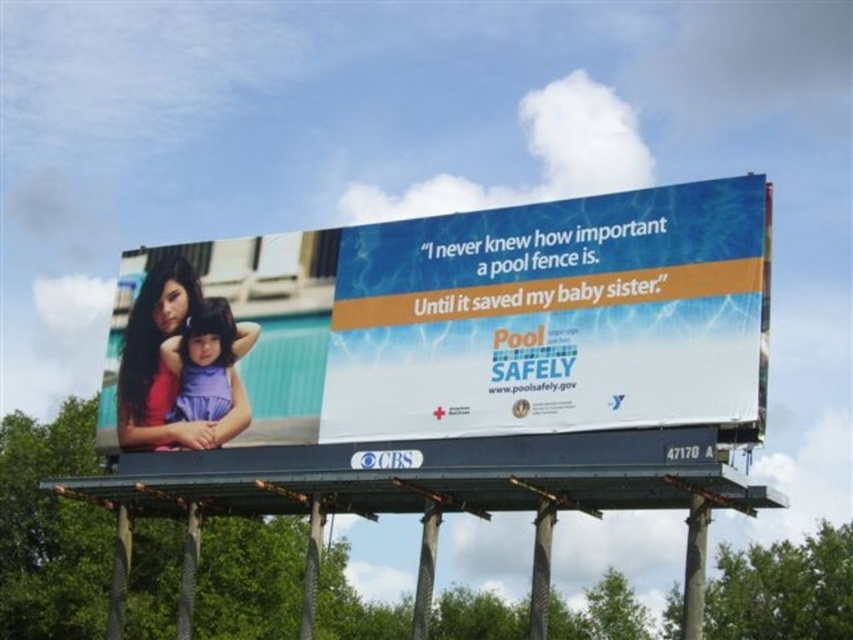
You are a city planner reviewing outdoor advertisements. You need to ensure that all billboards comply with the city ordinance requiring them to be placed at least 2 meters away from any public walkway. Given that the coordinates of the matte white billboard at center are at point 0.498, 0.585, can you determine if it meets the requirement?

The matte white billboard at center is located at point (498, 317). Since the coordinates provided do not include information about the distance to the nearest public walkway, it is impossible to determine compliance with the city ordinance based solely on the given data. Additional measurements or context regarding the walkway location are needed to make this assessment.

What is the relationship between the height of the matte white billboard at center and the purple fabric at left?

The matte white billboard at center is much taller than the purple fabric at left.

What is the relationship in size between the matte white billboard at center and the purple fabric at left?

The matte white billboard at center is bigger than the purple fabric at left.